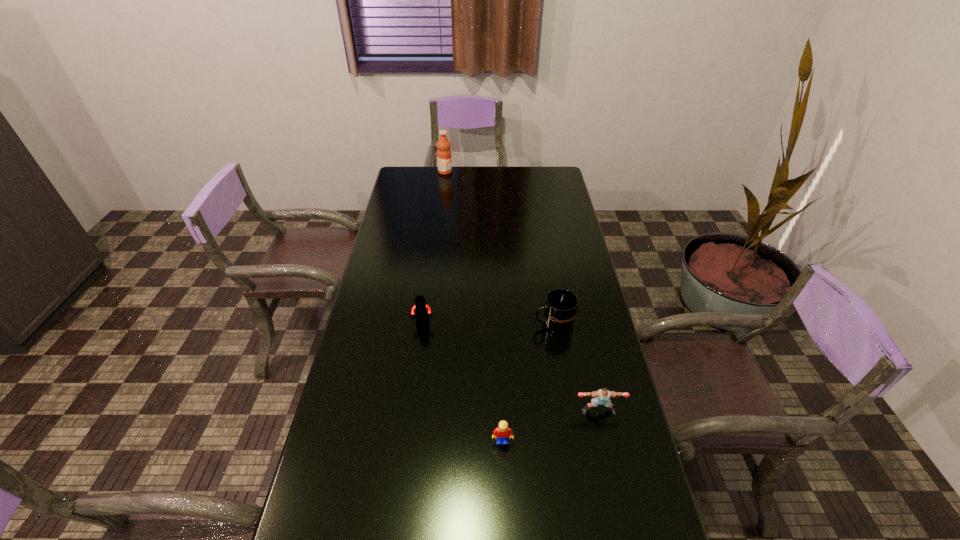
Where is `blank space at the right edge of the desktop`? blank space at the right edge of the desktop is located at coordinates (595, 306).

The image size is (960, 540). Find the location of `vacant space at the far left corner of the desktop`. vacant space at the far left corner of the desktop is located at coordinates (400, 171).

You are a GUI agent. You are given a task and a screenshot of the screen. Output one action in this format:
    pyautogui.click(x=<x>, y=<y>)
    Task: Click on the blank region between the left Lego and the fourth farthest object
    
    Given the screenshot: What is the action you would take?
    pyautogui.click(x=511, y=367)

Locate an element on the screen. vacant area that lies between the fruit juice and the left Lego is located at coordinates (434, 248).

This screenshot has width=960, height=540. In order to click on blank region between the left Lego and the second nearest object in this screenshot , I will do `click(511, 367)`.

Where is `empty space that is in between the tallest object and the mug`? empty space that is in between the tallest object and the mug is located at coordinates (x=499, y=247).

The image size is (960, 540). What are the coordinates of `free space that is in between the tallest object and the puncher` in the screenshot? It's located at (522, 292).

In order to click on free space between the shorter Lego and the second nearest object in this screenshot , I will do `click(550, 426)`.

Locate an element on the screen. vacant area that lies between the mug and the shortest object is located at coordinates (528, 382).

Identify which object is the nearest to the mug. Please provide its 2D coordinates. Your answer should be formatted as a tuple, i.e. [(x, y)], where the tuple contains the x and y coordinates of a point satisfying the conditions above.

[(602, 396)]